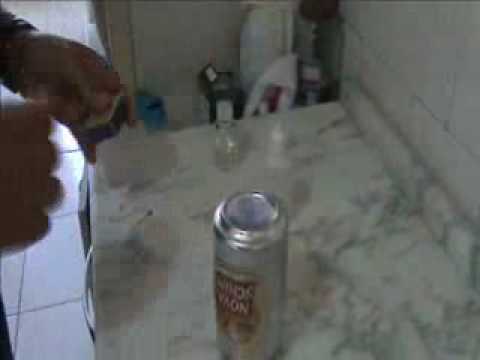
This screenshot has width=480, height=360. I want to click on looks like a drawer handle, so click(85, 289).